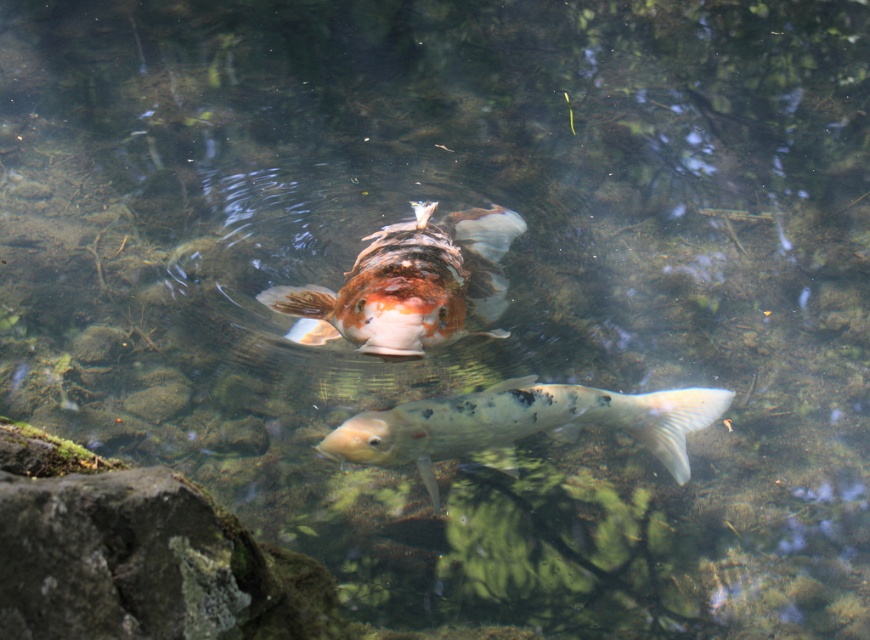
You are an underwater photographer aiming to capture both the shiny orange and white fish at center and the speckled white fish at center in a single frame. Based on their positions, which fish should you focus on first to ensure both are in the shot?

You should focus on the speckled white fish at center first because the shiny orange and white fish at center is to the left of it, so adjusting the frame to include both would require centering around the speckled white fish at center.

You are a photographer aiming to capture a clear image of the shiny orange and white fish at center. The water at point (409, 285) is 30 cm deep. Your camera requires at least 25 cm of water depth to focus properly. Can you take the photo at this location?

The water at point (409, 285) is 30 cm deep, which meets the minimum requirement of 25 cm. Therefore, you can take the photo at this location.